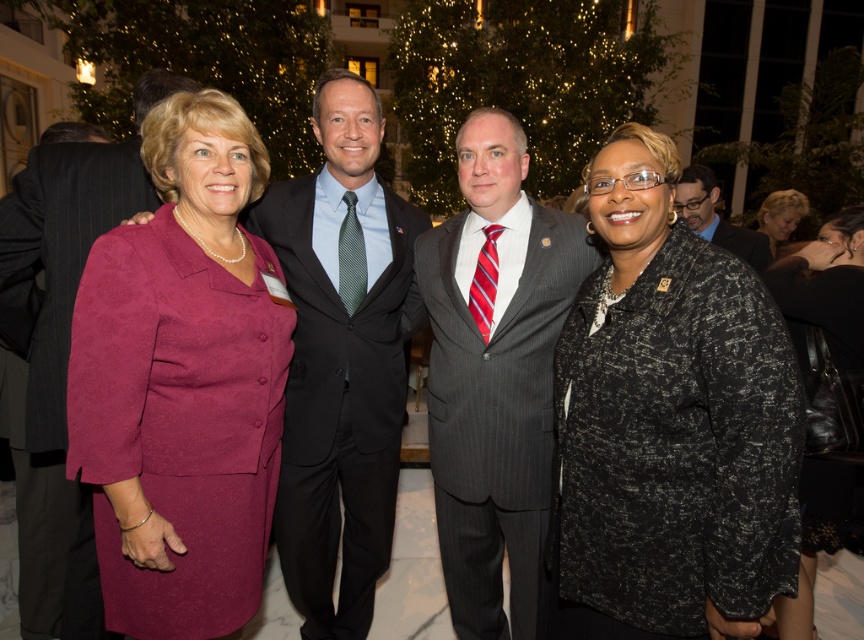
Question: Considering the relative positions of black textured blazer at right and matte black suit at center in the image provided, where is black textured blazer at right located with respect to matte black suit at center?

Choices:
 (A) above
 (B) below

Answer: (B)

Question: Is black textured blazer at right positioned before blonde hair at upper right?

Choices:
 (A) yes
 (B) no

Answer: (A)

Question: Which point appears farthest from the camera in this image?

Choices:
 (A) (72, 337)
 (B) (739, 228)
 (C) (700, 528)

Answer: (B)

Question: Which object is farther from the camera taking this photo?

Choices:
 (A) black pinstripe suit at center
 (B) dark gray pinstripe suit at center

Answer: (A)

Question: Which point is closer to the camera?

Choices:
 (A) (850, 349)
 (B) (780, 221)
 (C) (465, 182)

Answer: (C)

Question: Does black textured blazer at right have a greater width compared to matte black suit at center?

Choices:
 (A) yes
 (B) no

Answer: (B)